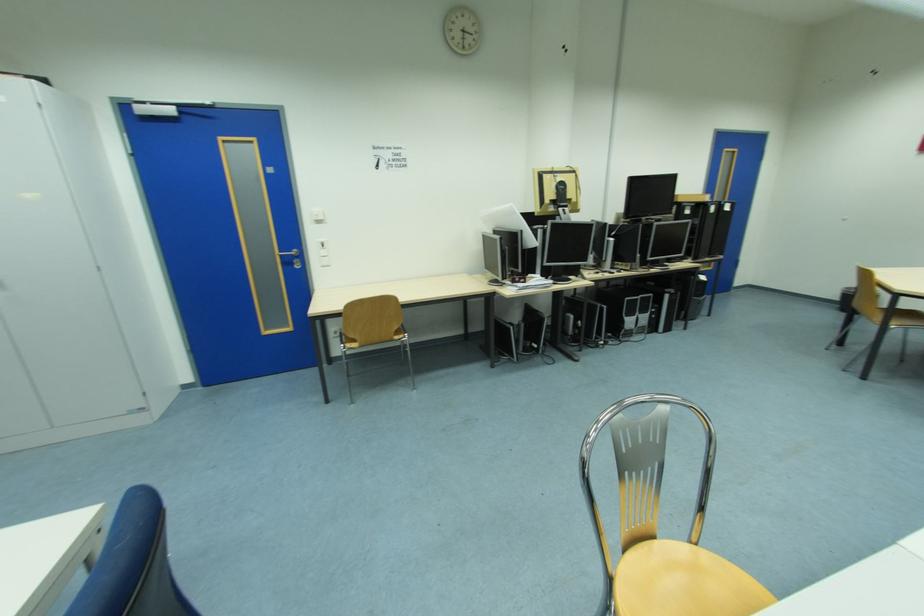
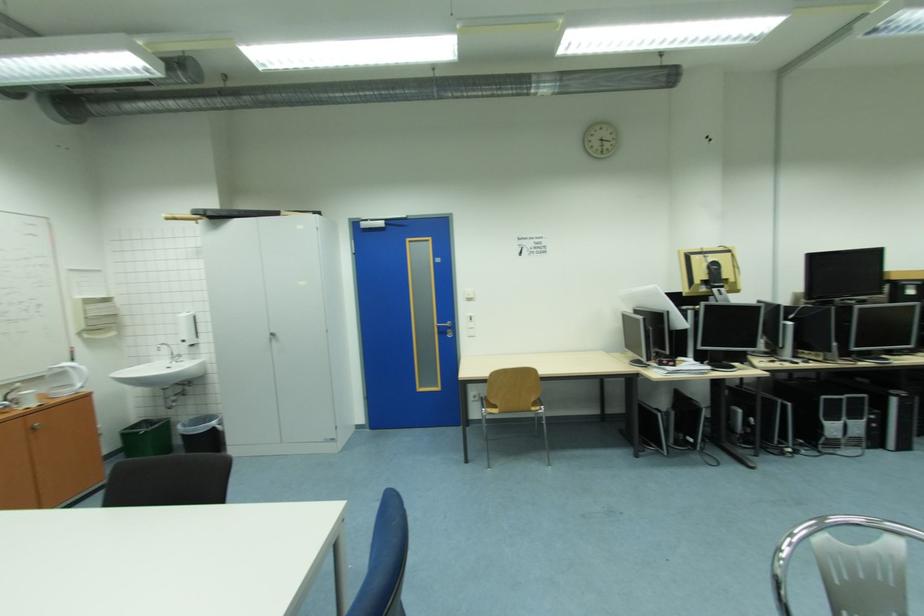
Find the pixel in the second image that matches point 287,257 in the first image.

(445, 328)